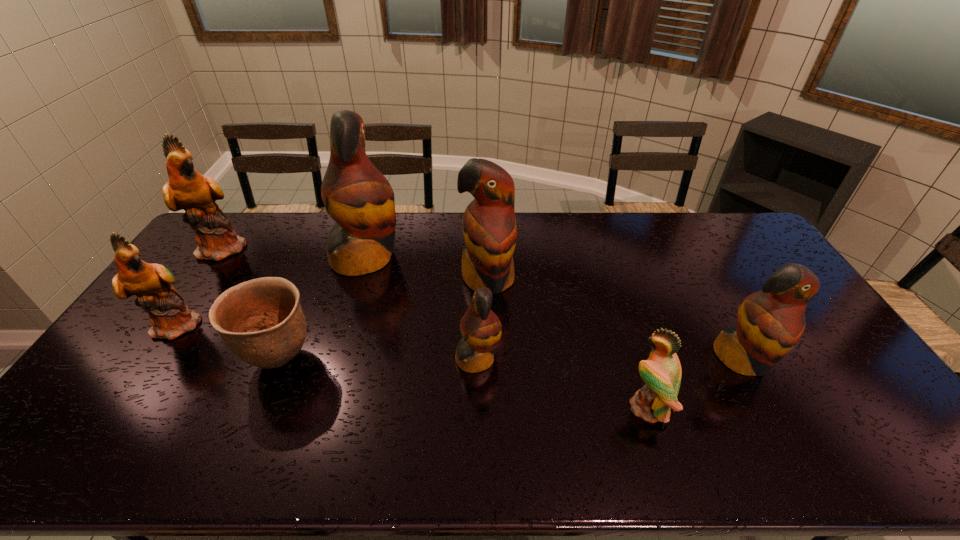
Locate which green parrot is the second closest to the rightmost red parrot. Please provide its 2D coordinates. Your answer should be formatted as a tuple, i.e. [(x, y)], where the tuple contains the x and y coordinates of a point satisfying the conditions above.

[(170, 317)]

Where is `vacant area that satisfies the following two spatial constraints: 1. on the face of the tallest object; 2. on the front side of the shortest object`? vacant area that satisfies the following two spatial constraints: 1. on the face of the tallest object; 2. on the front side of the shortest object is located at coordinates (336, 359).

What are the coordinates of `vacant space that satisfies the following two spatial constraints: 1. on the face of the third smallest red parrot; 2. on the face of the smallest red parrot` in the screenshot? It's located at (490, 359).